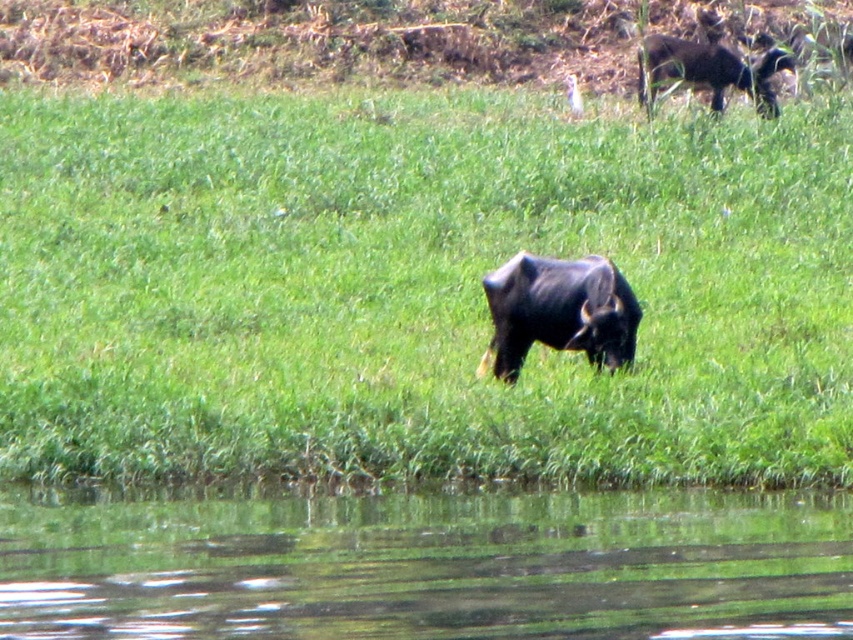
Question: Is green grass at center wider than green grassy river at lower center?

Choices:
 (A) no
 (B) yes

Answer: (B)

Question: Can you confirm if green grass at center is positioned below green grassy river at lower center?

Choices:
 (A) no
 (B) yes

Answer: (A)

Question: Which object is closer to the camera taking this photo?

Choices:
 (A) black glossy yak at center
 (B) green grass at center
 (C) green grassy river at lower center

Answer: (C)

Question: Can you confirm if green grassy river at lower center is thinner than black glossy yak at center?

Choices:
 (A) no
 (B) yes

Answer: (A)

Question: Based on their relative distances, which object is farther from the green grass at center?

Choices:
 (A) green grassy river at lower center
 (B) black glossy yak at center

Answer: (A)

Question: Which is nearer to the green grassy river at lower center?

Choices:
 (A) green grass at center
 (B) black glossy yak at center

Answer: (B)